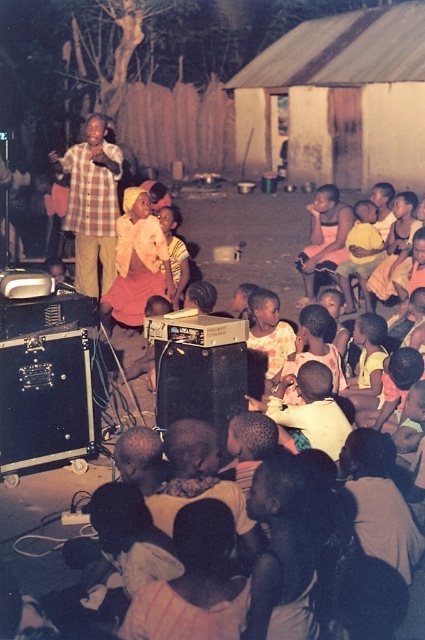
Where is `plaid fabric shirt at center`? plaid fabric shirt at center is located at coordinates (91, 204).

Which of these two, plaid fabric shirt at center or light brown skin at center, stands taller?

With more height is plaid fabric shirt at center.

Is point (76, 182) positioned before point (180, 298)?

Yes, point (76, 182) is in front of point (180, 298).

The width and height of the screenshot is (425, 640). I want to click on plaid fabric shirt at center, so click(x=91, y=204).